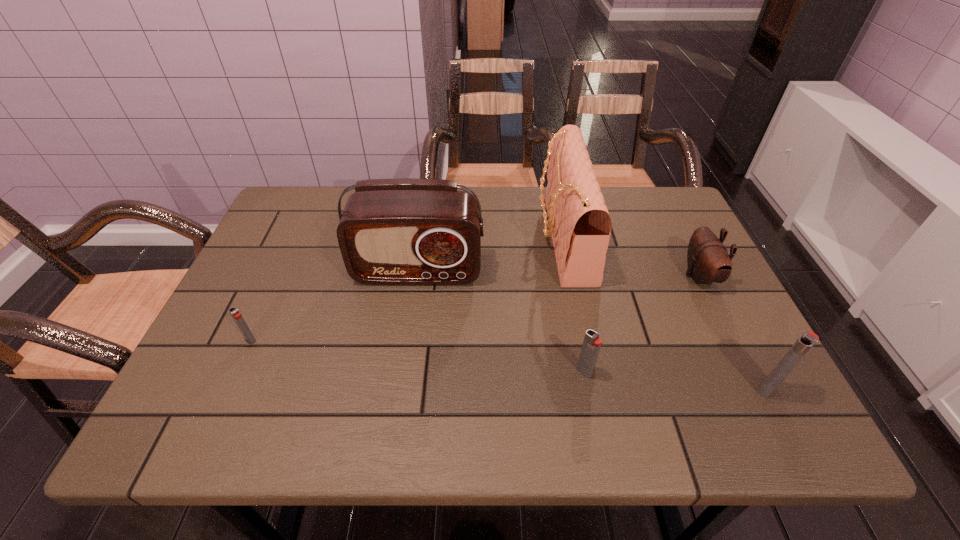
At what (x,y) coordinates should I click in order to perform the action: click on spot to insert another igniter for uniform distribution. Please return your answer as a coordinate pair (x, y). Looking at the image, I should click on click(x=413, y=356).